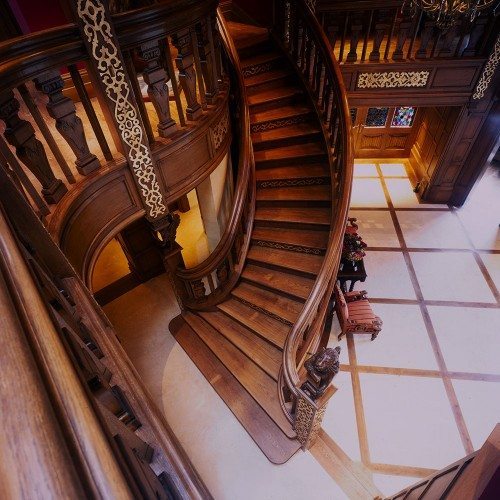
Find the location of a particular element. This screenshot has height=500, width=500. table is located at coordinates (355, 276).